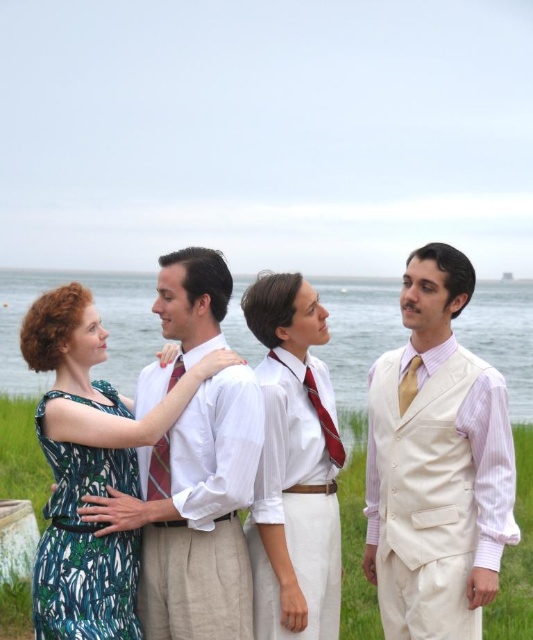
Question: Which of these objects is positioned farthest from the red satin tie at center?

Choices:
 (A) white cotton shirt at center
 (B) green floral fabric dress at left

Answer: (B)

Question: Which point is closer to the camera?

Choices:
 (A) (416, 392)
 (B) (432, 628)
 (C) (302, 420)

Answer: (B)

Question: Observing the image, what is the correct spatial positioning of light beige fabric vest at right in reference to clear blue water at center?

Choices:
 (A) above
 (B) below

Answer: (B)

Question: Is clear blue water at center bigger than red satin tie at center?

Choices:
 (A) no
 (B) yes

Answer: (B)

Question: Is green floral fabric dress at left to the left of red silk tie at center from the viewer's perspective?

Choices:
 (A) no
 (B) yes

Answer: (B)

Question: Among these objects, which one is farthest from the camera?

Choices:
 (A) light beige fabric vest at right
 (B) red silk tie at center
 (C) green floral dress at left
 (D) red satin tie at center

Answer: (D)